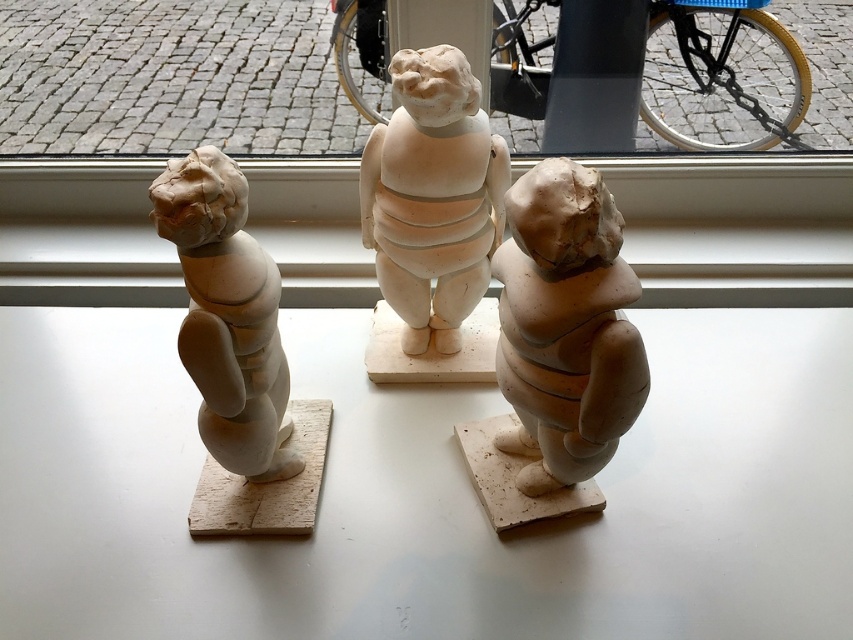
You are arranging miniature garden decorations on a shelf and have both the white matte window sill at center and the matte clay cherub at center. If you want to place them side by side without overlapping, which object should you place first to ensure there is enough space?

The white matte window sill at center occupies less space than the matte clay cherub at center, so you should place the matte clay cherub at center first to accommodate its larger size.

Based on the photo, you are an interior designer arranging items on the white matte window sill at center. You have a matte clay cherub at center that you want to place on it. Considering the height of the window sill, will the cherub be able to stand upright without falling over?

The white matte window sill at center is not as tall as the matte clay cherub at center, meaning the cherub is taller. Since the window sill is shorter, the cherub may be unstable and could tip over if placed directly on it. Consider using a taller base for support.

You have a small decorative item that is 10 cm wide. You want to place it on the white matte window sill at center without overlapping the matte clay figurine at left. Is there enough space on the window sill at center for your item?

The white matte window sill at center is wider than the matte clay figurine at left, so there is likely enough space to place your 10 cm wide decorative item without overlapping the figurine.